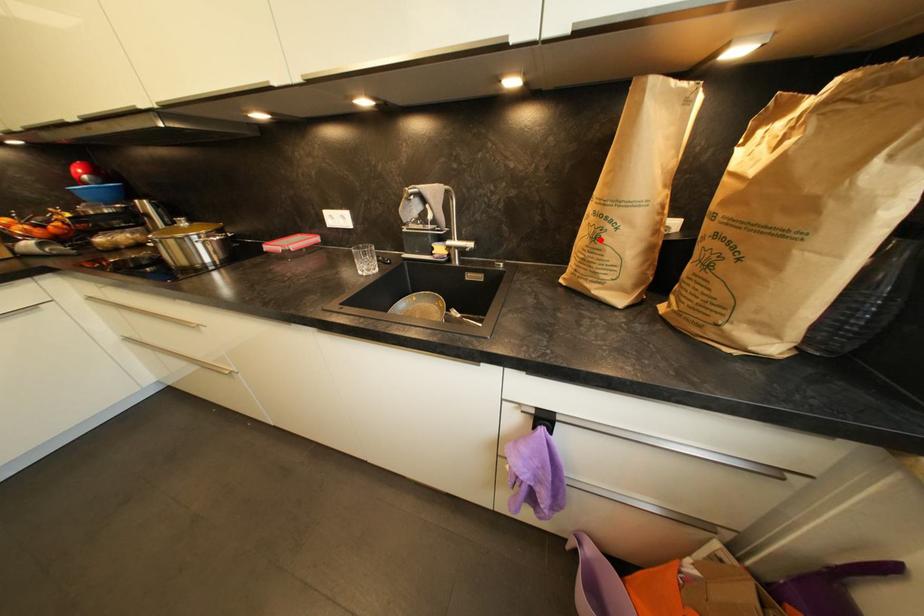
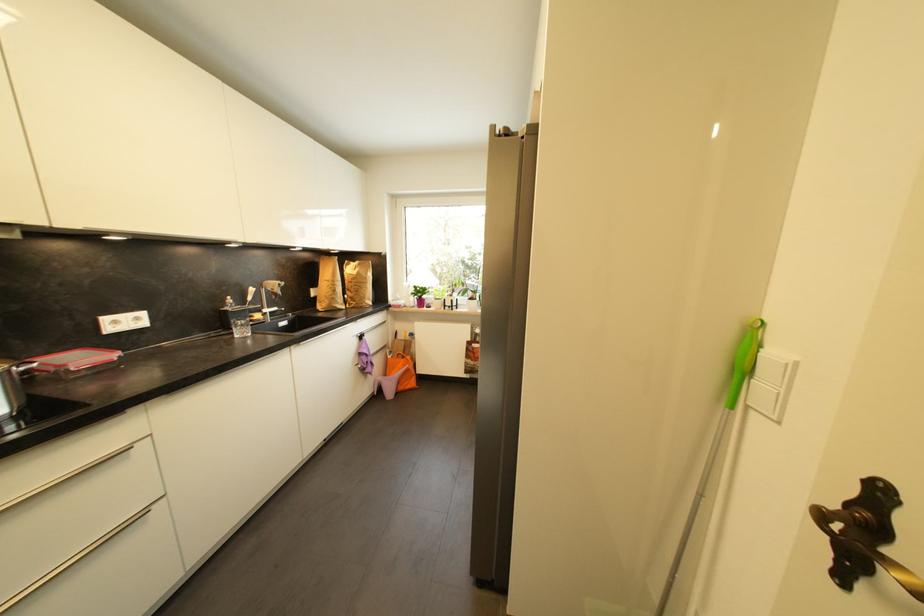
Find the pixel in the second image that matches the highlighted location in the first image.

(339, 293)